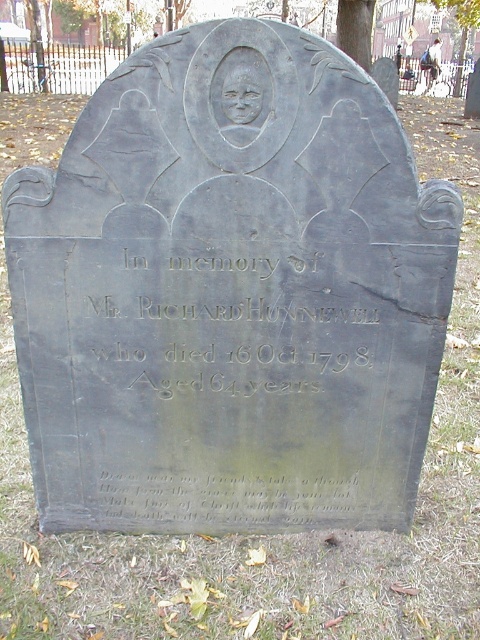
In the scene shown: Who is taller, black stone plaque at center or black stone inscription at lower center?

black stone plaque at center is taller.

The height and width of the screenshot is (640, 480). Describe the element at coordinates (224, 323) in the screenshot. I see `black stone plaque at center` at that location.

Who is more distant from viewer, [186,284] or [261,518]?

The point [261,518] is behind.

Where is `black stone plaque at center`? This screenshot has width=480, height=640. black stone plaque at center is located at coordinates (224, 323).